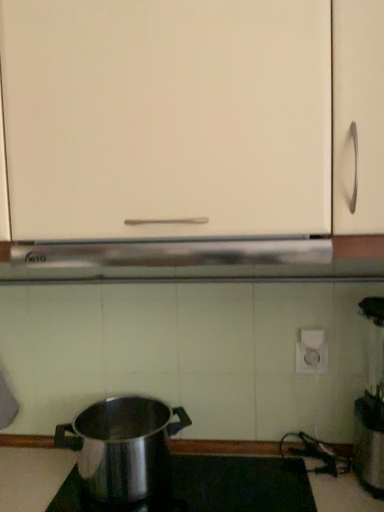
Question: Is white matte cabinet at center taller than polished stainless steel pot at lower left?

Choices:
 (A) yes
 (B) no

Answer: (A)

Question: From a real-world perspective, is white matte cabinet at center beneath polished stainless steel pot at lower left?

Choices:
 (A) yes
 (B) no

Answer: (B)

Question: Is white matte cabinet at center directly adjacent to polished stainless steel pot at lower left?

Choices:
 (A) yes
 (B) no

Answer: (B)

Question: Is white matte cabinet at center facing away from polished stainless steel pot at lower left?

Choices:
 (A) yes
 (B) no

Answer: (B)

Question: Is white matte cabinet at center thinner than polished stainless steel pot at lower left?

Choices:
 (A) no
 (B) yes

Answer: (A)

Question: From a real-world perspective, relative to white matte cabinet at center, is polished stainless steel pot at lower left vertically above or below?

Choices:
 (A) below
 (B) above

Answer: (A)

Question: In the image, is polished stainless steel pot at lower left on the left side or the right side of white matte cabinet at center?

Choices:
 (A) left
 (B) right

Answer: (A)

Question: From the image's perspective, is polished stainless steel pot at lower left positioned above or below white matte cabinet at center?

Choices:
 (A) below
 (B) above

Answer: (A)

Question: Is polished stainless steel pot at lower left taller or shorter than white matte cabinet at center?

Choices:
 (A) tall
 (B) short

Answer: (B)

Question: Looking at the image, does white matte cabinet at center seem bigger or smaller compared to polished stainless steel pot at lower left?

Choices:
 (A) big
 (B) small

Answer: (A)

Question: In the image, is white matte cabinet at center positioned in front of or behind polished stainless steel pot at lower left?

Choices:
 (A) front
 (B) behind

Answer: (A)

Question: From the image's perspective, is white matte cabinet at center located above or below polished stainless steel pot at lower left?

Choices:
 (A) below
 (B) above

Answer: (B)

Question: Based on their positions, is white matte cabinet at center located to the left or right of polished stainless steel pot at lower left?

Choices:
 (A) right
 (B) left

Answer: (A)

Question: From a real-world perspective, relative to white matte cabinet at center, is polished stainless steel pot at lower center vertically above or below?

Choices:
 (A) above
 (B) below

Answer: (B)

Question: In the image, is polished stainless steel pot at lower center positioned in front of or behind white matte cabinet at center?

Choices:
 (A) behind
 (B) front

Answer: (A)